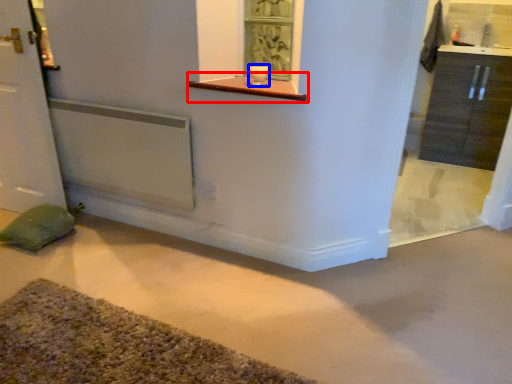
Question: Among these objects, which one is nearest to the camera, window sill (highlighted by a red box) or candle holder (highlighted by a blue box)?

Choices:
 (A) window sill
 (B) candle holder

Answer: (A)